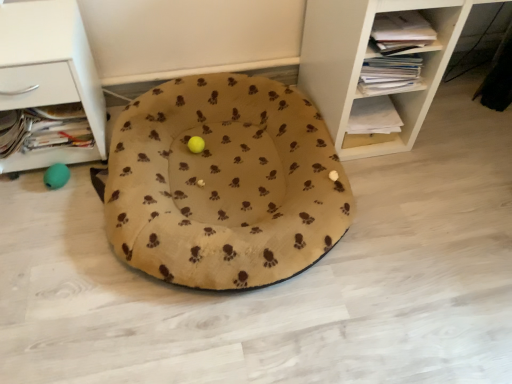
This screenshot has width=512, height=384. What do you see at coordinates (362, 60) in the screenshot? I see `white wood shelf at upper right, which ranks as the second shelf in left-to-right order` at bounding box center [362, 60].

What do you see at coordinates (49, 74) in the screenshot?
I see `white matte drawer at left, which is counted as the 1th shelf, starting from the left` at bounding box center [49, 74].

Locate an element on the screen. The image size is (512, 384). beige fleece dog bed at center is located at coordinates (223, 183).

Does beige fleece dog bed at center have a lesser width compared to white wood shelf at upper right, which is counted as the 1th shelf, starting from the right?

In fact, beige fleece dog bed at center might be wider than white wood shelf at upper right, which is counted as the 1th shelf, starting from the right.

Does beige fleece dog bed at center touch white wood shelf at upper right, which is counted as the 1th shelf, starting from the right?

No, beige fleece dog bed at center is not touching white wood shelf at upper right, which is counted as the 1th shelf, starting from the right.

Measure the distance from beige fleece dog bed at center to white wood shelf at upper right, which ranks as the second shelf in left-to-right order.

They are 15.87 inches apart.

Is white wood shelf at upper right, which ranks as the second shelf in left-to-right order, next to white matte drawer at left, which is counted as the 1th shelf, starting from the left, and touching it?

No, white wood shelf at upper right, which ranks as the second shelf in left-to-right order, is not touching white matte drawer at left, which is counted as the 1th shelf, starting from the left.

Is point (346, 64) farther from viewer compared to point (38, 27)?

Yes, point (346, 64) is farther from viewer.

From a real-world perspective, relative to white matte drawer at left, positioned as the 2th shelf in right-to-left order, is white wood shelf at upper right, which is counted as the 1th shelf, starting from the right, vertically above or below?

Clearly, from a real-world perspective, white wood shelf at upper right, which is counted as the 1th shelf, starting from the right, is above white matte drawer at left, positioned as the 2th shelf in right-to-left order.

From the image's perspective, would you say white wood shelf at upper right, which is counted as the 1th shelf, starting from the right, is shown under white matte drawer at left, positioned as the 2th shelf in right-to-left order?

No, from the image's perspective, white wood shelf at upper right, which is counted as the 1th shelf, starting from the right, is not beneath white matte drawer at left, positioned as the 2th shelf in right-to-left order.

Locate an element on the screen. The image size is (512, 384). shelf below the white wood shelf at upper right, which ranks as the second shelf in left-to-right order (from a real-world perspective) is located at coordinates click(49, 74).

Would you say white matte drawer at left, positioned as the 2th shelf in right-to-left order, is a long distance from white wood shelf at upper right, which is counted as the 1th shelf, starting from the right?

They are positioned close to each other.

Between point (75, 60) and point (331, 113), which one is positioned behind?

Point (331, 113)

Based on the photo, from a real-world perspective, is white matte drawer at left, positioned as the 2th shelf in right-to-left order, on white wood shelf at upper right, which ranks as the second shelf in left-to-right order?

No, from a real-world perspective, white matte drawer at left, positioned as the 2th shelf in right-to-left order, is not above white wood shelf at upper right, which ranks as the second shelf in left-to-right order.

Choose the correct answer: Is white matte drawer at left, positioned as the 2th shelf in right-to-left order, inside beige fleece dog bed at center or outside it?

white matte drawer at left, positioned as the 2th shelf in right-to-left order, is not enclosed by beige fleece dog bed at center.

From the picture: What's the angular difference between white matte drawer at left, which is counted as the 1th shelf, starting from the left, and beige fleece dog bed at center's facing directions?

They differ by 0.696 degrees in their facing directions.

Where is `shelf located on the left of beige fleece dog bed at center`? Image resolution: width=512 pixels, height=384 pixels. shelf located on the left of beige fleece dog bed at center is located at coordinates (49, 74).

Is white matte drawer at left, positioned as the 2th shelf in right-to-left order, far away from beige fleece dog bed at center?

white matte drawer at left, positioned as the 2th shelf in right-to-left order, is near beige fleece dog bed at center, not far away.

Considering the positions of objects white wood shelf at upper right, which ranks as the second shelf in left-to-right order, and beige fleece dog bed at center in the image provided, who is more to the right, white wood shelf at upper right, which ranks as the second shelf in left-to-right order, or beige fleece dog bed at center?

white wood shelf at upper right, which ranks as the second shelf in left-to-right order, is more to the right.

In terms of size, does white wood shelf at upper right, which ranks as the second shelf in left-to-right order, appear bigger or smaller than beige fleece dog bed at center?

Considering their sizes, white wood shelf at upper right, which ranks as the second shelf in left-to-right order, takes up more space than beige fleece dog bed at center.

Considering the positions of objects beige fleece dog bed at center and white matte drawer at left, which is counted as the 1th shelf, starting from the left, in the image provided, who is behind, beige fleece dog bed at center or white matte drawer at left, which is counted as the 1th shelf, starting from the left,?

white matte drawer at left, which is counted as the 1th shelf, starting from the left, is behind.

Is beige fleece dog bed at center in contact with white matte drawer at left, which is counted as the 1th shelf, starting from the left?

No, beige fleece dog bed at center is not making contact with white matte drawer at left, which is counted as the 1th shelf, starting from the left.

Can you tell me how much beige fleece dog bed at center and white matte drawer at left, positioned as the 2th shelf in right-to-left order, differ in facing direction?

beige fleece dog bed at center and white matte drawer at left, positioned as the 2th shelf in right-to-left order, are facing 0.696 degrees away from each other.

Where is `shelf in front of the beige fleece dog bed at center`? shelf in front of the beige fleece dog bed at center is located at coordinates (362, 60).

In order to click on shelf that is behind the white wood shelf at upper right, which is counted as the 1th shelf, starting from the right in this screenshot , I will do pos(49,74).

From the image, which object appears to be farther from white wood shelf at upper right, which ranks as the second shelf in left-to-right order, beige fleece dog bed at center or white matte drawer at left, positioned as the 2th shelf in right-to-left order?

white matte drawer at left, positioned as the 2th shelf in right-to-left order, lies further to white wood shelf at upper right, which ranks as the second shelf in left-to-right order, than the other object.

Which object lies further to the anchor point white matte drawer at left, positioned as the 2th shelf in right-to-left order, beige fleece dog bed at center or white wood shelf at upper right, which is counted as the 1th shelf, starting from the right?

white wood shelf at upper right, which is counted as the 1th shelf, starting from the right, is positioned further to the anchor white matte drawer at left, positioned as the 2th shelf in right-to-left order.

In the scene shown: From the image, which object appears to be nearer to beige fleece dog bed at center, white wood shelf at upper right, which is counted as the 1th shelf, starting from the right, or white matte drawer at left, which is counted as the 1th shelf, starting from the left?

white wood shelf at upper right, which is counted as the 1th shelf, starting from the right, lies closer to beige fleece dog bed at center than the other object.

From the image, which object appears to be farther from white matte drawer at left, positioned as the 2th shelf in right-to-left order, white wood shelf at upper right, which ranks as the second shelf in left-to-right order, or beige fleece dog bed at center?

The object further to white matte drawer at left, positioned as the 2th shelf in right-to-left order, is white wood shelf at upper right, which ranks as the second shelf in left-to-right order.

Based on their spatial positions, is white matte drawer at left, positioned as the 2th shelf in right-to-left order, or white wood shelf at upper right, which ranks as the second shelf in left-to-right order, closer to beige fleece dog bed at center?

The object closer to beige fleece dog bed at center is white wood shelf at upper right, which ranks as the second shelf in left-to-right order.

From the image, which object appears to be farther from white wood shelf at upper right, which is counted as the 1th shelf, starting from the right, white matte drawer at left, which is counted as the 1th shelf, starting from the left, or beige fleece dog bed at center?

white matte drawer at left, which is counted as the 1th shelf, starting from the left, is positioned further to the anchor white wood shelf at upper right, which is counted as the 1th shelf, starting from the right.

The width and height of the screenshot is (512, 384). What are the coordinates of `dog bed between white matte drawer at left, which is counted as the 1th shelf, starting from the left, and white wood shelf at upper right, which is counted as the 1th shelf, starting from the right, in the horizontal direction` in the screenshot? It's located at (223, 183).